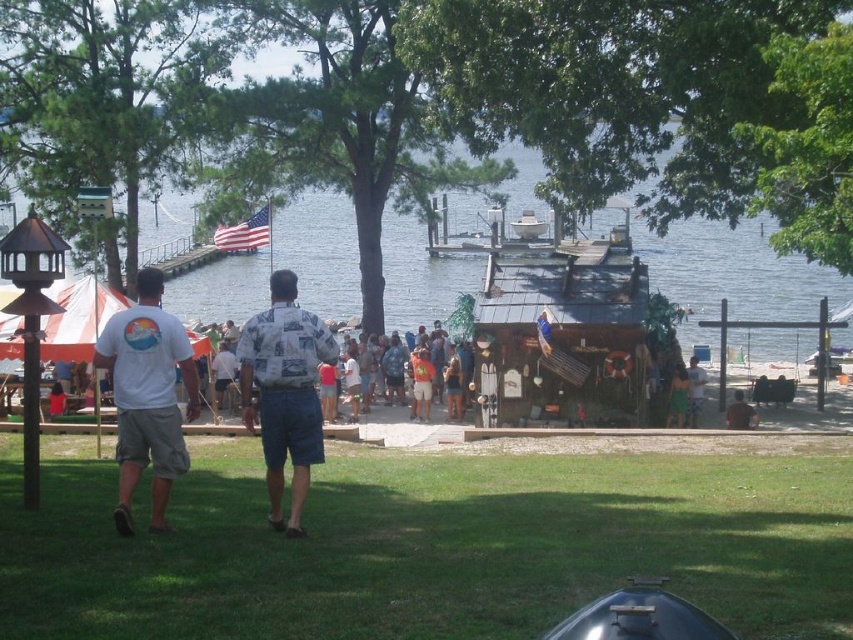
Question: Which of the following is the farthest from the observer?

Choices:
 (A) (152, 300)
 (B) (256, 320)
 (C) (665, 602)
 (D) (421, 365)

Answer: (D)

Question: Can you confirm if clear blue water at center is smaller than green fabric dress at center?

Choices:
 (A) yes
 (B) no

Answer: (B)

Question: Does green fabric dress at center have a larger size compared to brown leather chair at lower right?

Choices:
 (A) yes
 (B) no

Answer: (A)

Question: Does green grass at lower center appear under camouflage shirt at center?

Choices:
 (A) no
 (B) yes

Answer: (B)

Question: Which point is farther to the camera?

Choices:
 (A) white cotton t-shirt at left
 (B) camouflage shirt at center
 (C) green fabric dress at center
 (D) metallic silver grill at lower center

Answer: (B)

Question: Based on their relative distances, which object is farther from the green grass at lower center?

Choices:
 (A) hawaiian shirt at center
 (B) white cotton t-shirt at left
 (C) green fabric dress at center

Answer: (C)